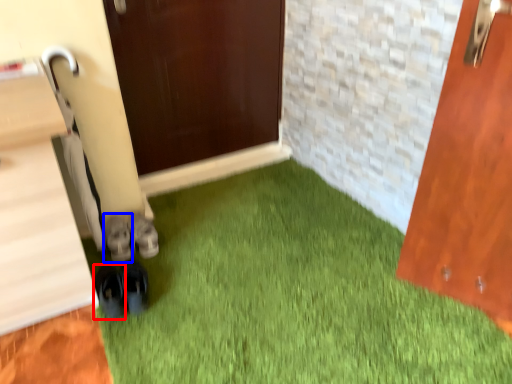
Question: Among these objects, which one is farthest to the camera, footwear (highlighted by a red box) or footwear (highlighted by a blue box)?

Choices:
 (A) footwear
 (B) footwear

Answer: (B)